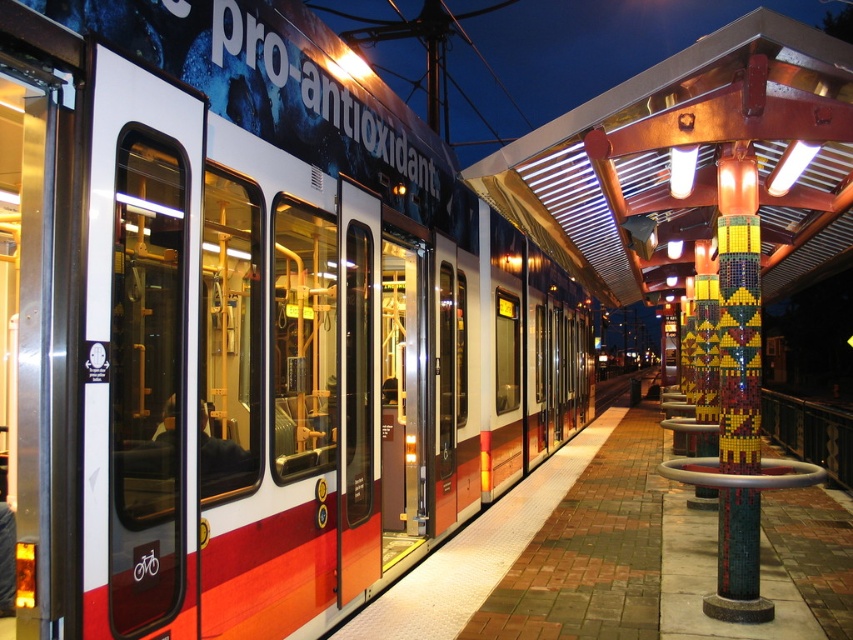
Is point (711, 612) positioned behind point (711, 346)?

No, (711, 612) is in front of (711, 346).

Who is more forward, (726, 371) or (698, 332)?

Point (726, 371) is more forward.

Locate an element on the screen. mosaic tile column at right is located at coordinates (738, 308).

Find the location of a particular element. Image resolution: width=853 pixels, height=640 pixels. mosaic tile column at right is located at coordinates (738, 308).

Does metallic red train at center have a lesser height compared to mosaic tile column at right?

No.

Does point (242, 51) come in front of point (718, 548)?

Yes, point (242, 51) is in front of point (718, 548).

Where is `metallic red train at center`? metallic red train at center is located at coordinates (247, 324).

Can you confirm if metallic red train at center is positioned to the right of multicolored mosaic pillar at right?

In fact, metallic red train at center is to the left of multicolored mosaic pillar at right.

Does point (122, 556) lie behind point (698, 394)?

No, it is in front of (698, 394).

Locate an element on the screen. metallic red train at center is located at coordinates tap(247, 324).